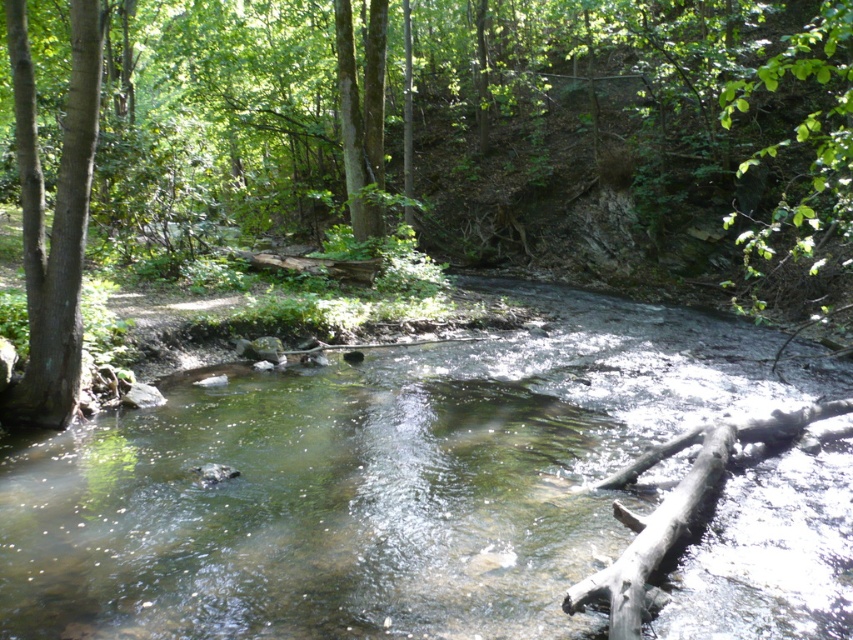
Between clear water at center and green smooth tree trunk at left, which one is positioned lower?

Positioned lower is clear water at center.

Is clear water at center smaller than green smooth tree trunk at left?

No.

Between point (694, 572) and point (36, 324), which one is positioned in front?

Positioned in front is point (694, 572).

The height and width of the screenshot is (640, 853). I want to click on clear water at center, so click(x=376, y=483).

Who is positioned more to the right, clear water at center or gray rough log at lower right?

Result: Positioned to the right is gray rough log at lower right.

Can you confirm if clear water at center is taller than gray rough log at lower right?

Correct, clear water at center is much taller as gray rough log at lower right.

Where is `clear water at center`? clear water at center is located at coordinates pyautogui.click(x=376, y=483).

Locate an element on the screen. clear water at center is located at coordinates (376, 483).

Between point (567, 52) and point (88, 192), which one is positioned in front?

Positioned in front is point (88, 192).

Measure the distance between point (x=462, y=156) and camera.

Point (x=462, y=156) is 36.39 meters from camera.

Where is `green leafy tree at center`? The image size is (853, 640). green leafy tree at center is located at coordinates pos(503,131).